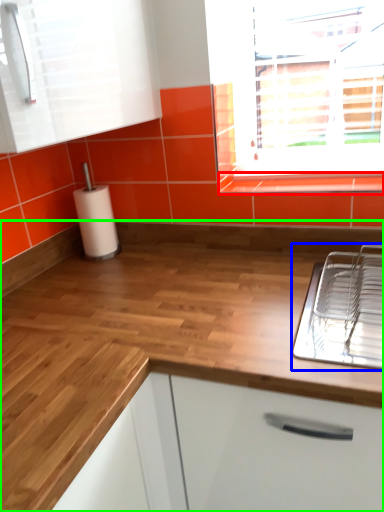
Question: Which object is positioned farthest from window sill (highlighted by a red box)? Select from appliance (highlighted by a blue box) and countertop (highlighted by a green box).

Choices:
 (A) appliance
 (B) countertop

Answer: (B)